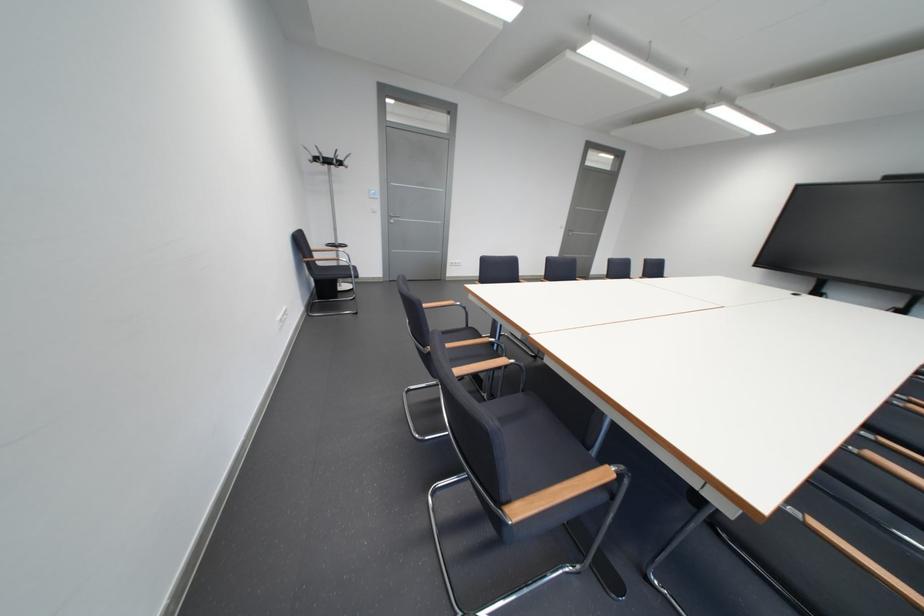
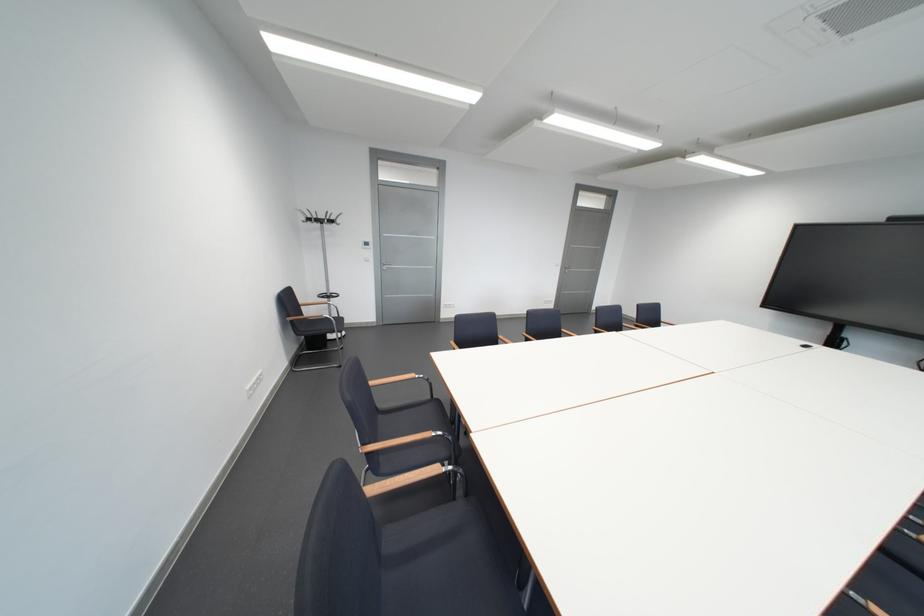
Question: How did the camera likely rotate?

Choices:
 (A) Left
 (B) Right
 (C) Up
 (D) Down

Answer: (C)